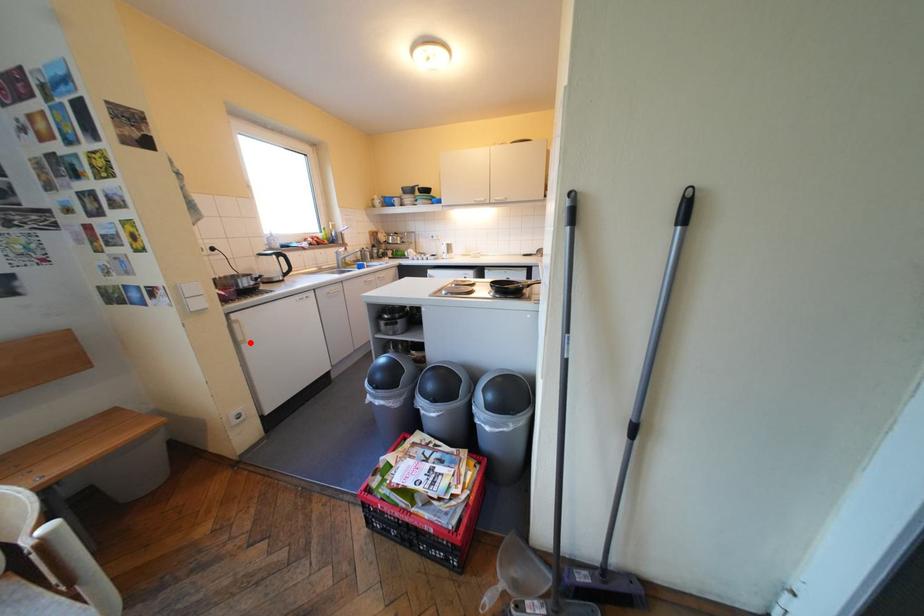
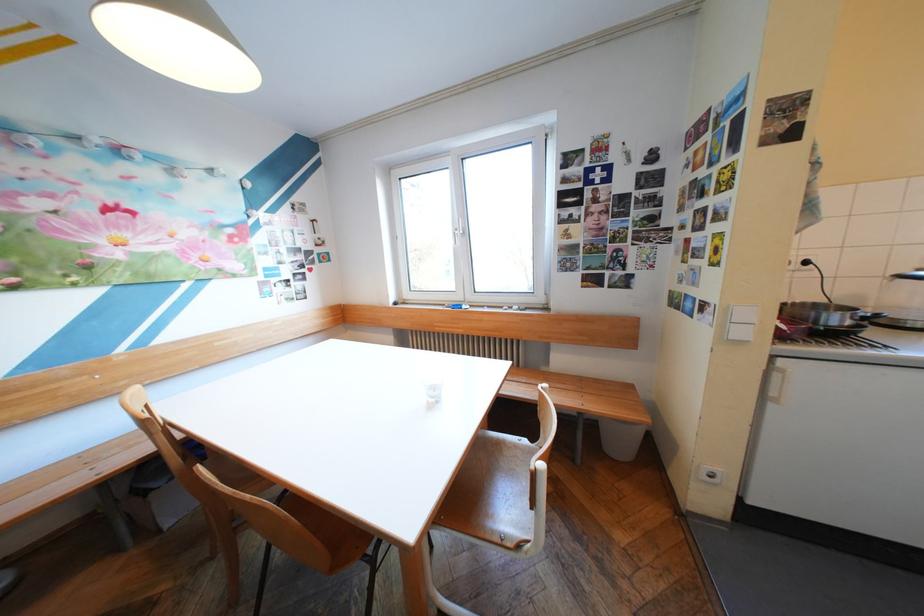
Find the pixel in the second image that matches the highlighted location in the first image.

(776, 397)